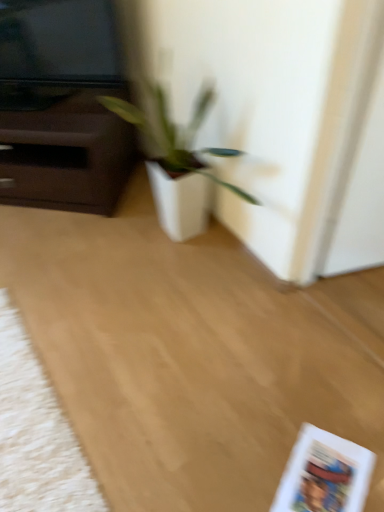
Find the location of `blank space situated above white matte plant pot at center (from a real-world perspective)`. blank space situated above white matte plant pot at center (from a real-world perspective) is located at coordinates (153, 329).